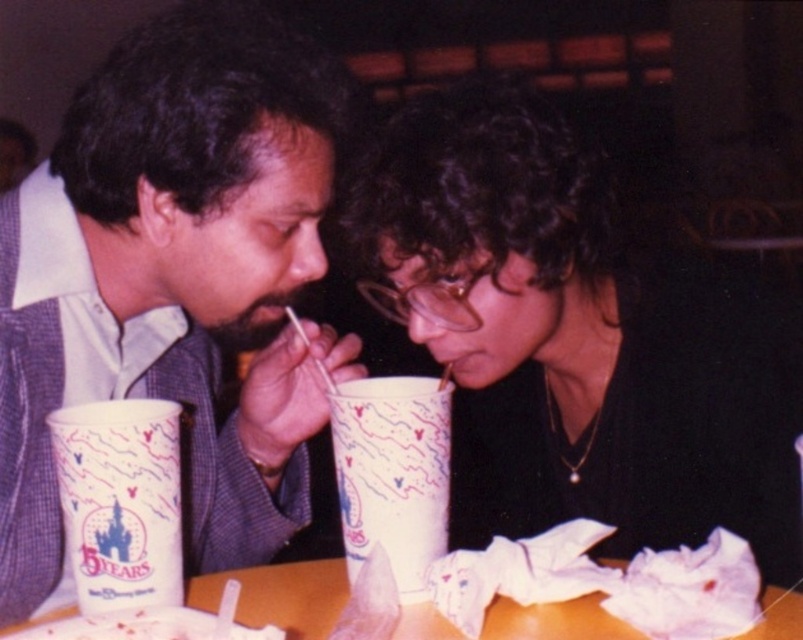
Is matte black cup at center positioned at the back of wooden table at center?

Yes, matte black cup at center is further from the viewer.

Can you confirm if matte black cup at center is smaller than wooden table at center?

No, matte black cup at center is not smaller than wooden table at center.

Is point (483, 516) positioned behind point (614, 621)?

That is True.

Where is `matte black cup at center`? matte black cup at center is located at coordinates (577, 339).

Can you confirm if matte black cup at center is positioned to the right of white paper napkin at lower center?

Correct, you'll find matte black cup at center to the right of white paper napkin at lower center.

Does matte black cup at center have a lesser height compared to white paper napkin at lower center?

No, matte black cup at center is not shorter than white paper napkin at lower center.

Is point (426, 147) more distant than point (190, 625)?

Yes, it is behind point (190, 625).

This screenshot has width=803, height=640. I want to click on matte black cup at center, so click(x=577, y=339).

Who is taller, white paper cup at left or white paper cup at center?

white paper cup at center

Does white paper cup at left have a greater height compared to white paper cup at center?

In fact, white paper cup at left may be shorter than white paper cup at center.

Who is more distant from viewer, (170, 588) or (357, 445)?

The point (357, 445) is more distant.

At what (x,y) coordinates should I click in order to perform the action: click on white paper cup at left. Please return your answer as a coordinate pair (x, y). Looking at the image, I should click on (120, 500).